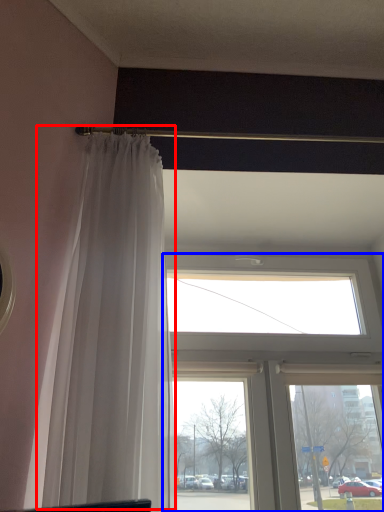
Question: Among these objects, which one is nearest to the camera, curtain (highlighted by a red box) or window (highlighted by a blue box)?

Choices:
 (A) curtain
 (B) window

Answer: (A)